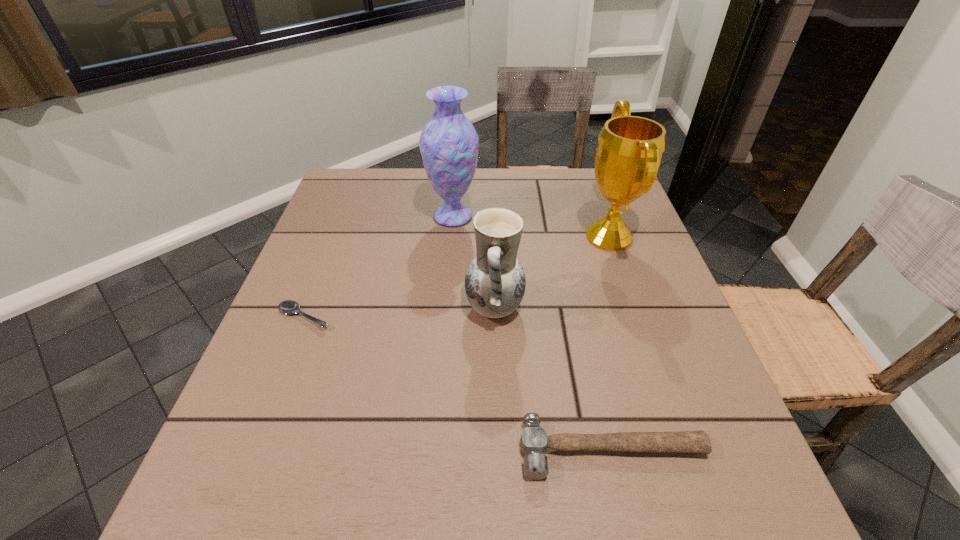
Find the location of a particular element. The width and height of the screenshot is (960, 540). vacant space situated 0.110m on the front-facing side of the award is located at coordinates (536, 237).

At what (x,y) coordinates should I click in order to perform the action: click on free space located 0.330m on either side of the third shortest object. Please return your answer as a coordinate pair (x, y). Image resolution: width=960 pixels, height=540 pixels. Looking at the image, I should click on (307, 308).

The width and height of the screenshot is (960, 540). I want to click on vacant space located on either side of the third shortest object, so click(x=365, y=308).

This screenshot has height=540, width=960. What are the coordinates of `vacant space located on either side of the third shortest object` in the screenshot? It's located at (379, 308).

The width and height of the screenshot is (960, 540). I want to click on free location located on the right of the shortest object, so click(357, 316).

Where is `vase that is at the far edge`? vase that is at the far edge is located at coordinates (449, 144).

Where is `award positioned at the far edge`? This screenshot has width=960, height=540. award positioned at the far edge is located at coordinates (630, 149).

Image resolution: width=960 pixels, height=540 pixels. I want to click on object located at the near edge, so click(534, 441).

Find the location of a particular element. This screenshot has height=540, width=960. object located at the left edge is located at coordinates (288, 307).

This screenshot has width=960, height=540. In order to click on award present at the right edge in this screenshot , I will do `click(630, 149)`.